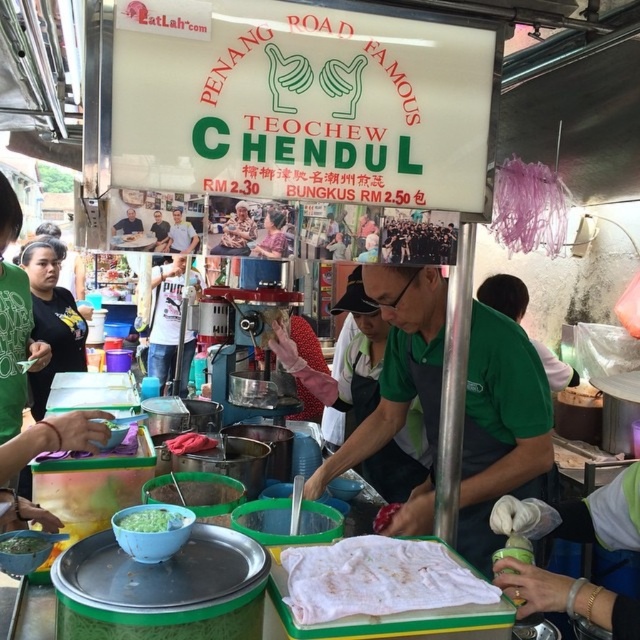
Question: Which object is closer to the camera taking this photo?

Choices:
 (A) green fabric apron at center
 (B) black fabric shirt at left

Answer: (A)

Question: Does green fabric apron at center have a smaller size compared to green matte bowl at center?

Choices:
 (A) no
 (B) yes

Answer: (A)

Question: Can you confirm if black fabric shirt at left is thinner than green matte bowl at center?

Choices:
 (A) yes
 (B) no

Answer: (B)

Question: Considering the real-world distances, which object is farthest from the green fabric apron at center?

Choices:
 (A) green matte bowl at lower left
 (B) light brown wooden table at center

Answer: (A)

Question: Is green fabric apron at center above black fabric shirt at left?

Choices:
 (A) no
 (B) yes

Answer: (A)

Question: Among these points, which one is farthest from the camera?

Choices:
 (A) (65, 312)
 (B) (166, 518)
 (C) (28, 548)

Answer: (A)